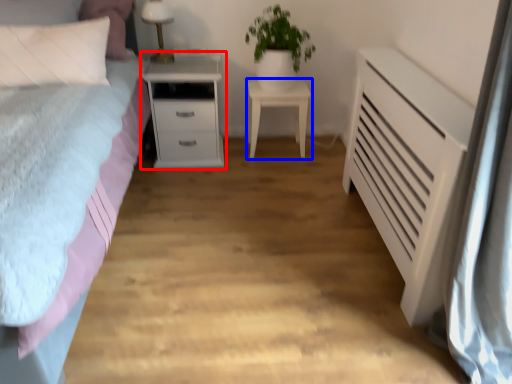
Question: Which of the following is the closest to the observer, nightstand (highlighted by a red box) or nightstand (highlighted by a blue box)?

Choices:
 (A) nightstand
 (B) nightstand

Answer: (A)